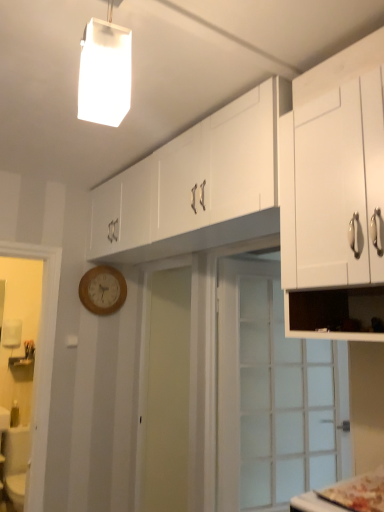
Question: From a real-world perspective, is white matte cabinet at upper right, arranged as the 1th cabinetry when viewed from the front, above or below white glossy cabinet at upper center, marked as the second cabinetry in a front-to-back arrangement?

Choices:
 (A) above
 (B) below

Answer: (B)

Question: Is point (306, 216) closer or farther from the camera than point (137, 236)?

Choices:
 (A) farther
 (B) closer

Answer: (B)

Question: Which is farther from the white glossy cabinet at upper center, the 1th cabinetry from the back?

Choices:
 (A) clear glass door at center
 (B) white matte cabinet at upper right, arranged as the 1th cabinetry when viewed from the front
 (C) white matte rectangular light fixture at upper center
 (D) wooden clock at center-left

Answer: (A)

Question: Which object is the farthest from the white matte cabinet at upper right, arranged as the 1th cabinetry when viewed from the front?

Choices:
 (A) white glossy cabinet at upper center, marked as the second cabinetry in a front-to-back arrangement
 (B) wooden clock at center-left
 (C) clear glass door at center
 (D) white matte rectangular light fixture at upper center

Answer: (B)